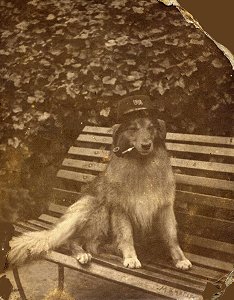
At what (x,y) coordinates should I click in order to perform the action: click on bench seat. Please return your answer as a coordinate pair (x, y). Looking at the image, I should click on (201, 268), (41, 225).